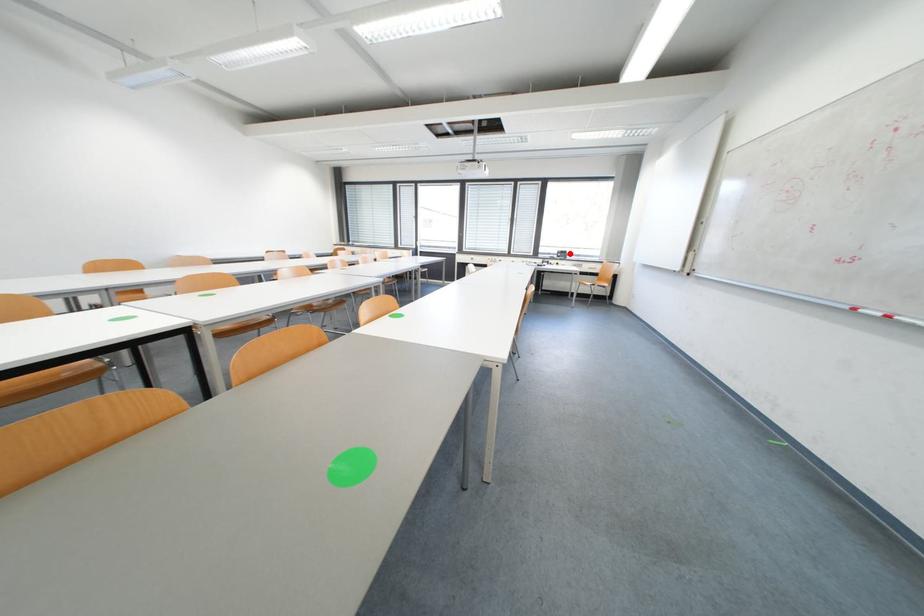
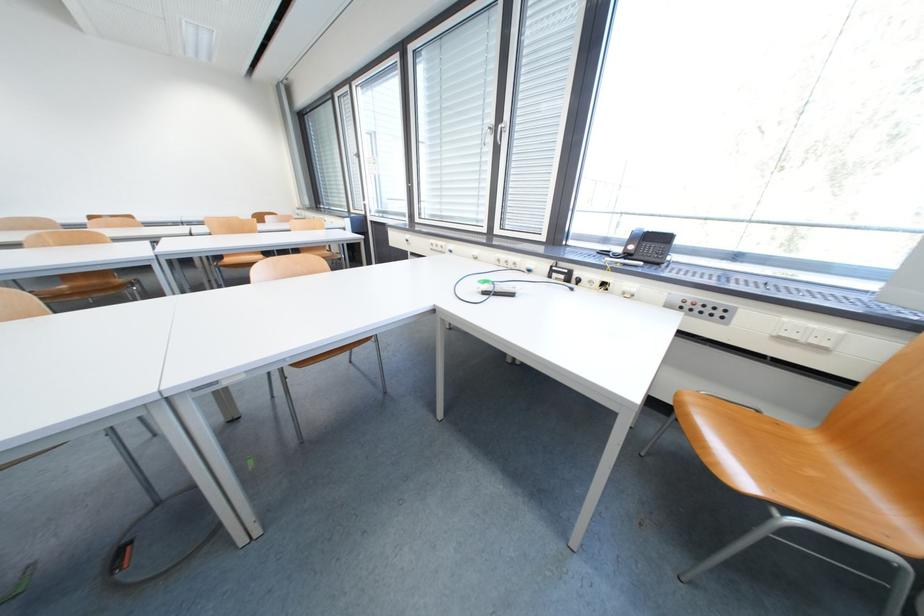
Question: A red point is marked in image1. In image2, is the corresponding 3D point closer to the camera or farther? Reply with the corresponding letter.

Choices:
 (A) The corresponding 3D point is closer.
 (B) The corresponding 3D point is farther.

Answer: (B)